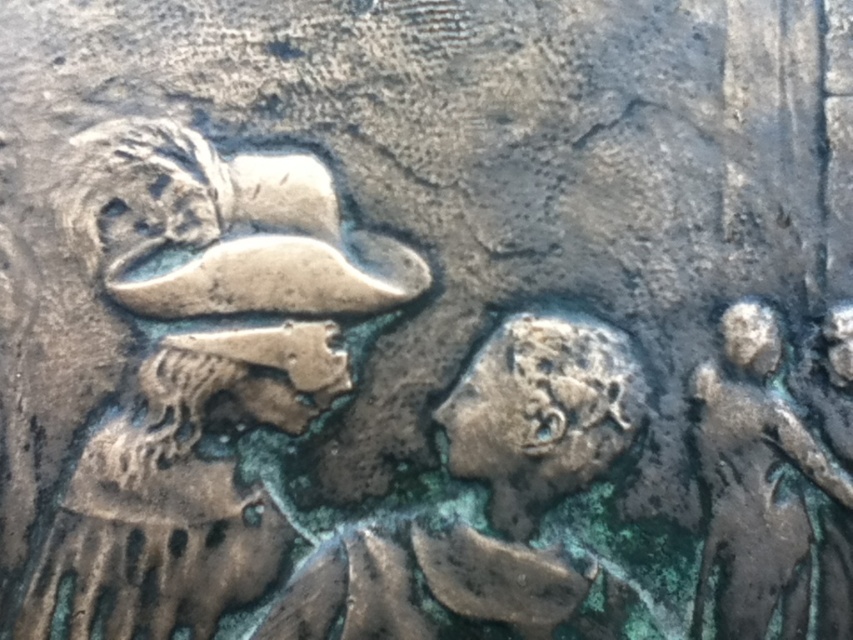
Looking at this image, you are an art conservator examining the sculpture. You need to determine the spatial relationship between the bronze textured bust at left and the green patina figure at right. Which object is placed higher in the composition?

The bronze textured bust at left is positioned over the green patina figure at right, meaning it is placed higher in the composition.

Looking at this image, looking at the metallic relief sculpture, you notice two figures. The bronze textured bust at left and the green patina figure at right. Which one is taller?

The bronze textured bust at left is taller than the green patina figure at right.

You are an art conservator examining the sculpture. You notice two elements, the bronze textured bust at left and the green patina figure at right. Which of these two elements is positioned to the left side of the other?

The bronze textured bust at left is positioned to the left of the green patina figure at right.